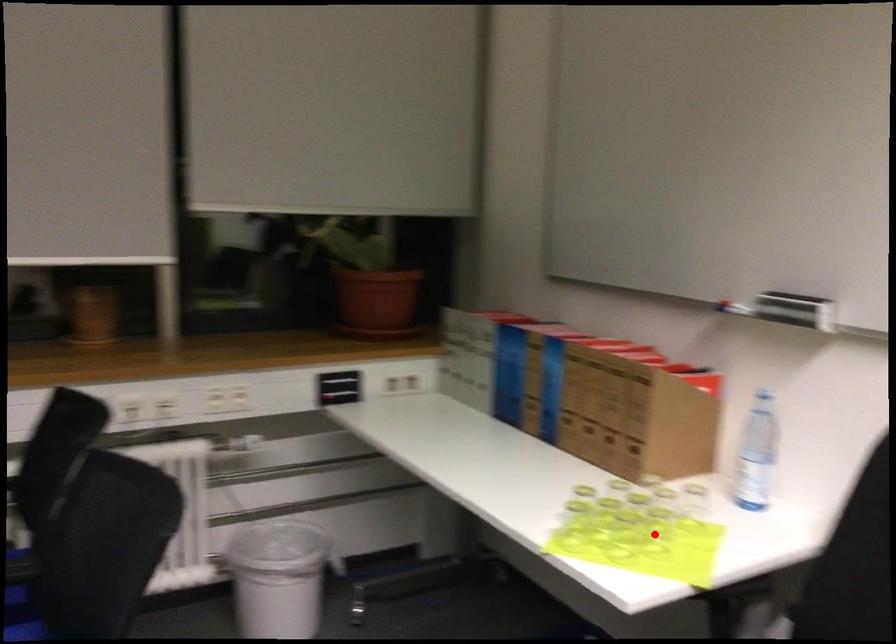
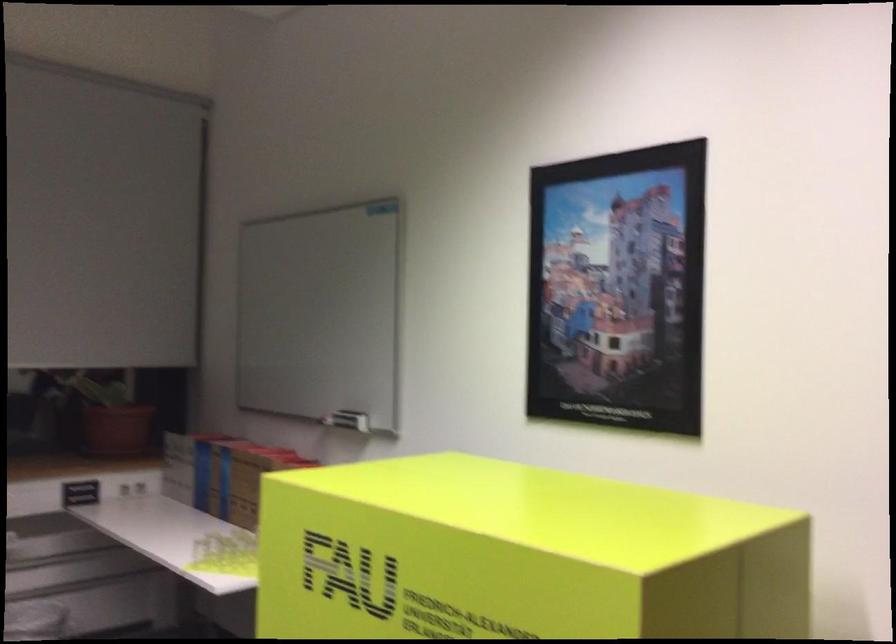
Question: I am providing you with two images of the same scene from different viewpoints. A red point is marked on the first image. At the location where the point appears in image 1, is it still visible in image 2?

Choices:
 (A) Yes
 (B) No

Answer: (B)